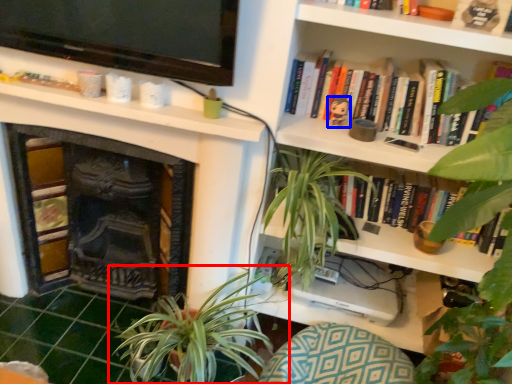
Question: Which of the following is the farthest to the observer, houseplant (highlighted by a red box) or toy (highlighted by a blue box)?

Choices:
 (A) houseplant
 (B) toy

Answer: (B)